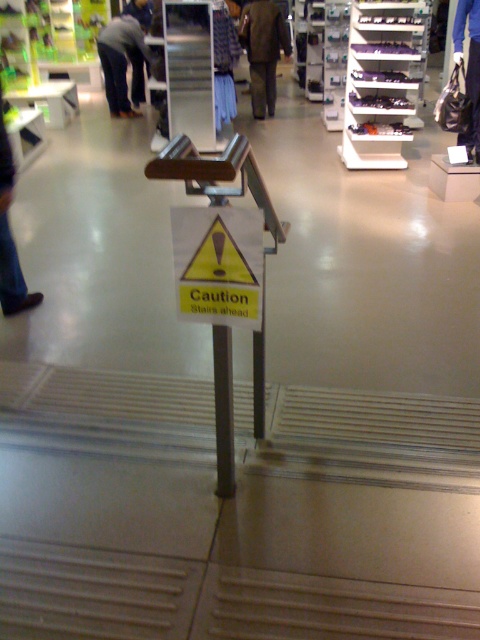
You are standing at the entrance of the store and want to take a photo of the yellow warning sign on the stairs. You have two points marked on your map as potential vantage points. One is at point (238, 285) and the other is at point (142, 26). Which point will give you a closer view of the yellow warning sign?

Point (238, 285) is closer to the camera than point (142, 26), so it will provide a closer view of the yellow warning sign.

You are a customer in a store and you see a yellow paper sign at center and dark gray pants at left. Which item takes up more space in the store?

The dark gray pants at left takes up more space than the yellow paper sign at center.

You are a customer in the store and want to compare the dark gray pants at left and the blue jeans at center. Which one is taller?

The dark gray pants at left is much taller than the blue jeans at center.